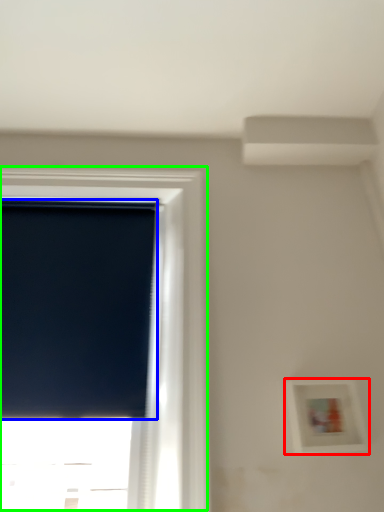
Question: Which is farther away from picture frame (highlighted by a red box)? window screen (highlighted by a blue box) or window (highlighted by a green box)?

Choices:
 (A) window screen
 (B) window

Answer: (A)